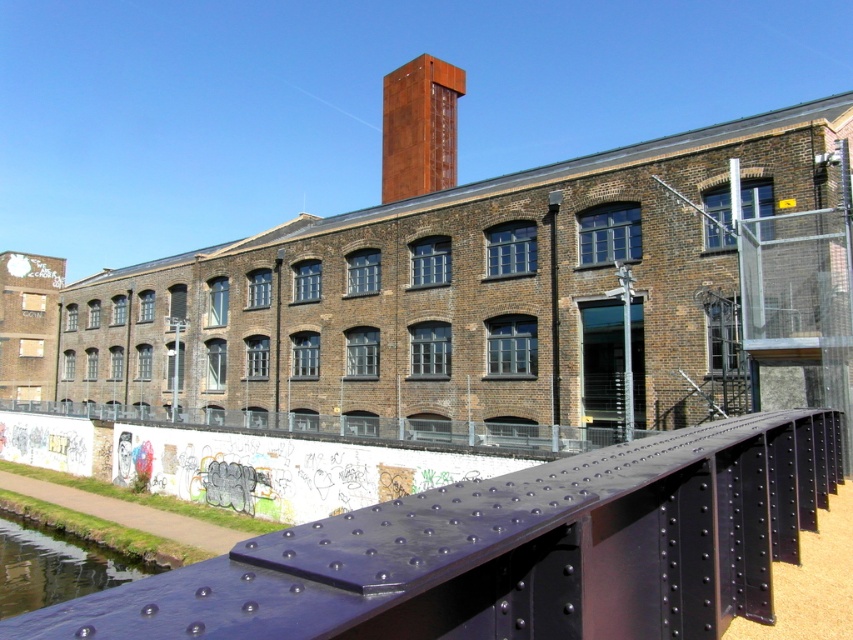
Question: Which point is farther to the camera?

Choices:
 (A) brown brick building at center
 (B) clear glass water at lower left
 (C) smooth steel rail at lower center

Answer: (B)

Question: Among these objects, which one is nearest to the camera?

Choices:
 (A) brown brick building at center
 (B) smooth steel rail at lower center
 (C) clear glass water at lower left

Answer: (B)

Question: Which object is the closest to the smooth steel rail at lower center?

Choices:
 (A) clear glass water at lower left
 (B) brown brick building at center

Answer: (A)

Question: Is brown brick building at center to the left of clear glass water at lower left from the viewer's perspective?

Choices:
 (A) yes
 (B) no

Answer: (B)

Question: Is brown brick building at center thinner than smooth steel rail at lower center?

Choices:
 (A) yes
 (B) no

Answer: (B)

Question: Considering the relative positions of smooth steel rail at lower center and clear glass water at lower left in the image provided, where is smooth steel rail at lower center located with respect to clear glass water at lower left?

Choices:
 (A) above
 (B) below

Answer: (A)